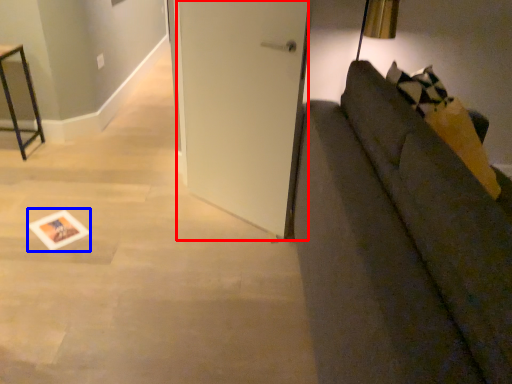
Question: Which point is further to the camera, door (highlighted by a red box) or postcard (highlighted by a blue box)?

Choices:
 (A) door
 (B) postcard

Answer: (B)